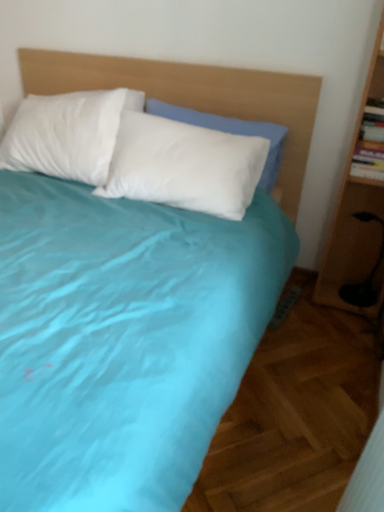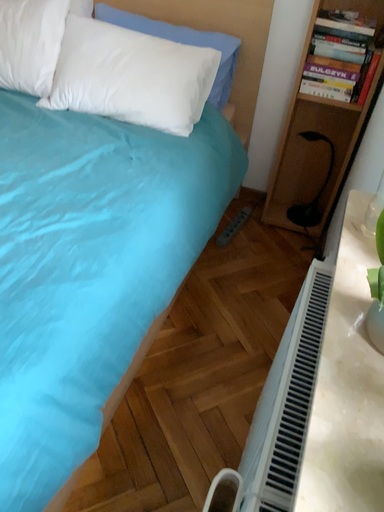
Question: How did the camera likely rotate when shooting the video?

Choices:
 (A) rotated downward
 (B) rotated upward

Answer: (A)